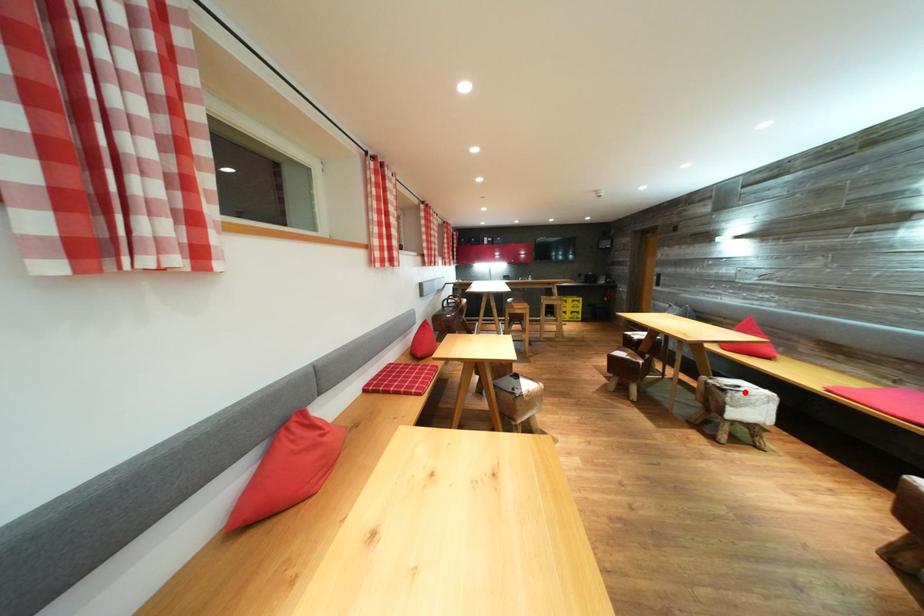
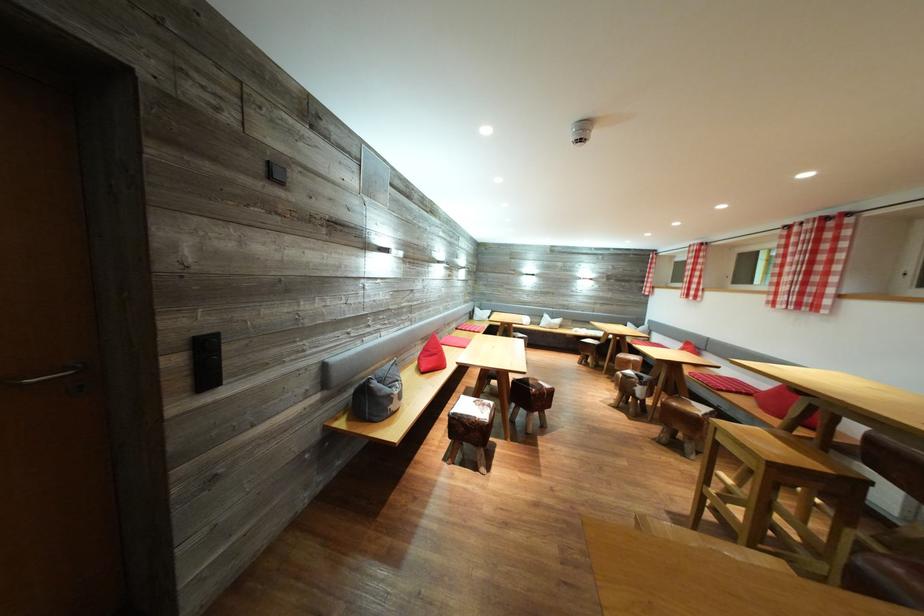
Question: I am providing you with two images of the same scene from different viewpoints. A red point is marked on the first image. Is the red point's position out of view in image 2?

Choices:
 (A) Yes
 (B) No

Answer: (A)